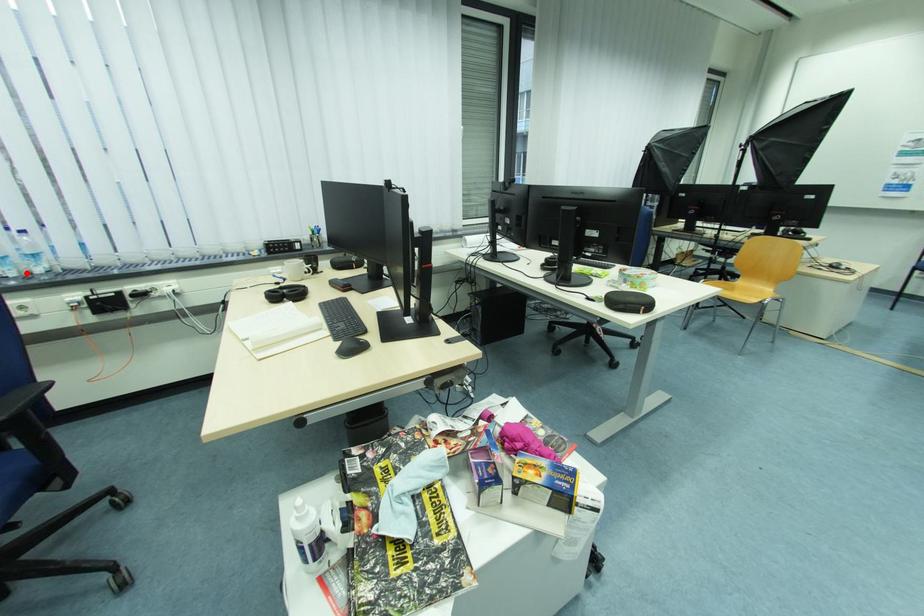
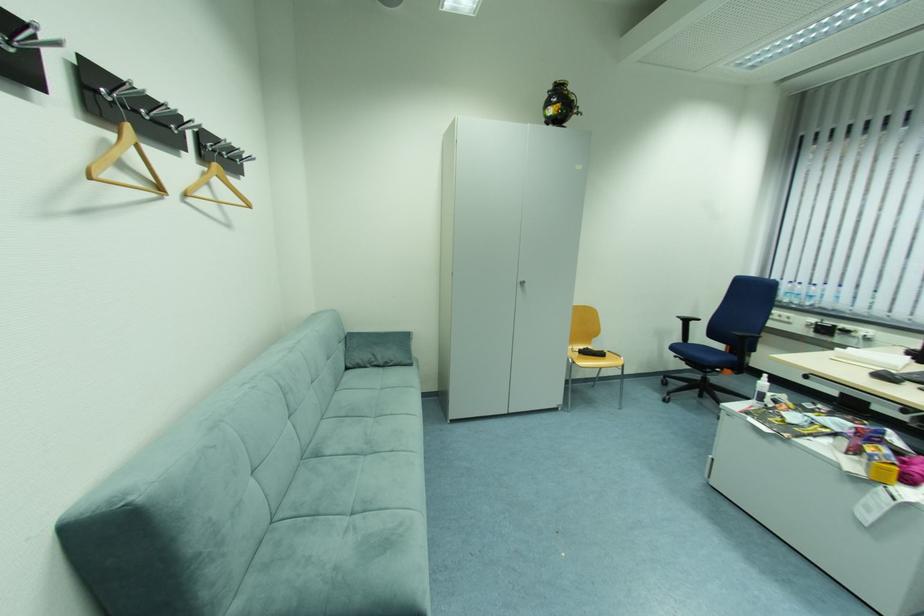
Where in the second image is the point corresponding to the highlighted location from the first image?

(807, 302)